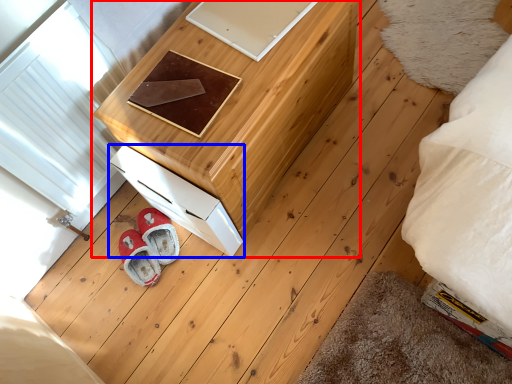
Question: Among these objects, which one is nearest to the camera, furniture (highlighted by a red box) or drawer (highlighted by a blue box)?

Choices:
 (A) furniture
 (B) drawer

Answer: (A)